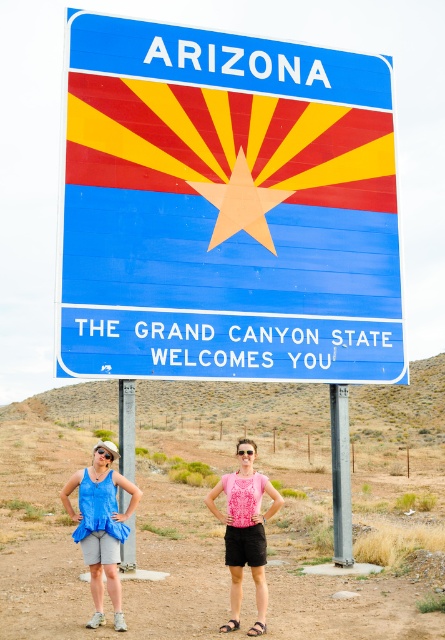
Measure the distance between point (112,547) and camera.

9.39 meters

Who is more distant from viewer, (109, 476) or (335, 508)?

The point (335, 508) is behind.

Which is in front, point (97, 580) or point (340, 401)?

Positioned in front is point (97, 580).

Locate an element on the screen. The width and height of the screenshot is (445, 640). blue fabric tank top at center is located at coordinates (101, 531).

Which of these two, blue painted sign at center or pink fabric top at center, stands shorter?

blue painted sign at center is shorter.

Which is below, blue painted sign at center or pink fabric top at center?

pink fabric top at center is below.

This screenshot has width=445, height=640. What do you see at coordinates (226, 208) in the screenshot? I see `blue painted sign at center` at bounding box center [226, 208].

Where is `blue painted sign at center`? blue painted sign at center is located at coordinates (226, 208).

In the scene shown: Who is positioned more to the left, pink fabric top at center or gray metallic pole at center?

From the viewer's perspective, pink fabric top at center appears more on the left side.

Between pink fabric top at center and gray metallic pole at center, which one has less height?

With less height is pink fabric top at center.

Where is `pink fabric top at center`? This screenshot has width=445, height=640. pink fabric top at center is located at coordinates (245, 536).